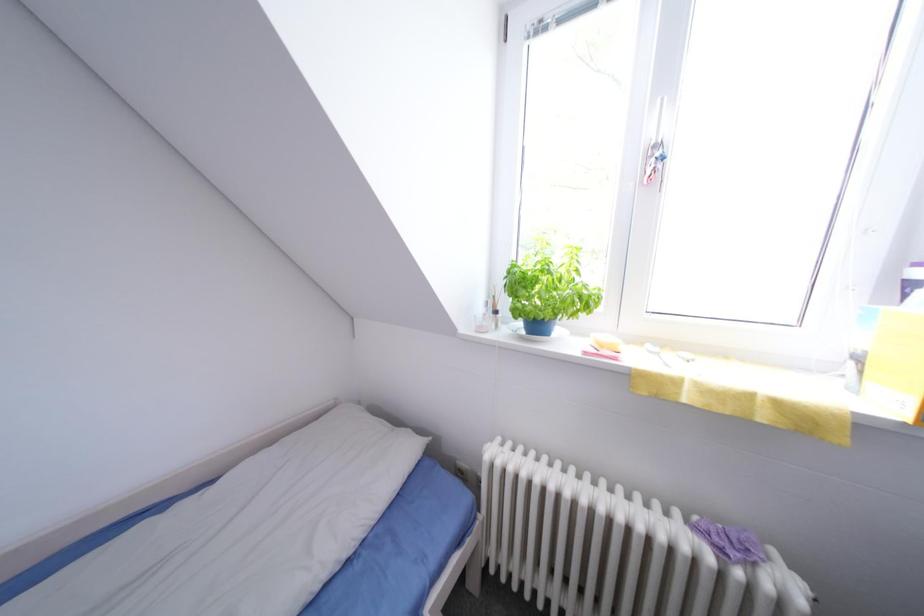
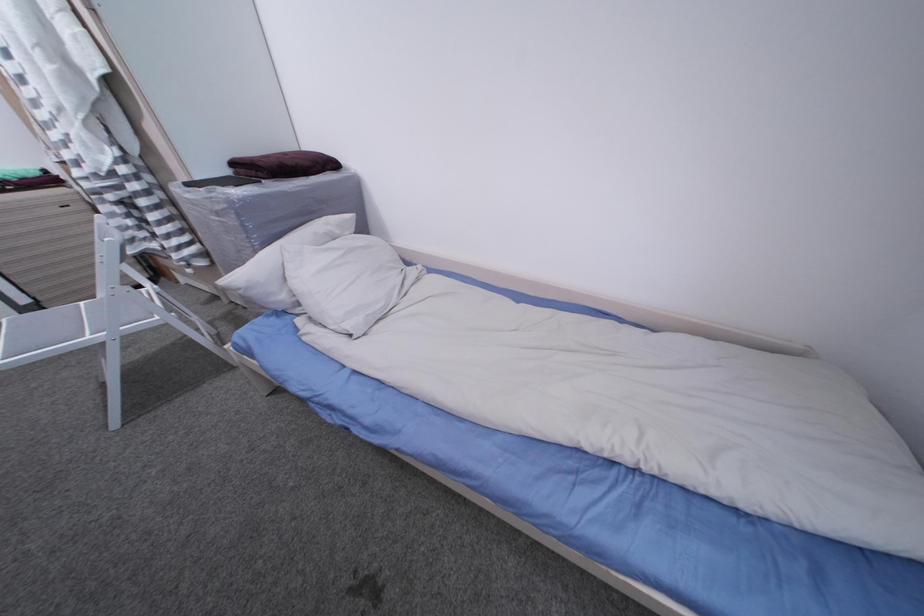
How did the camera likely rotate?

The rotation direction of the camera is left-down.